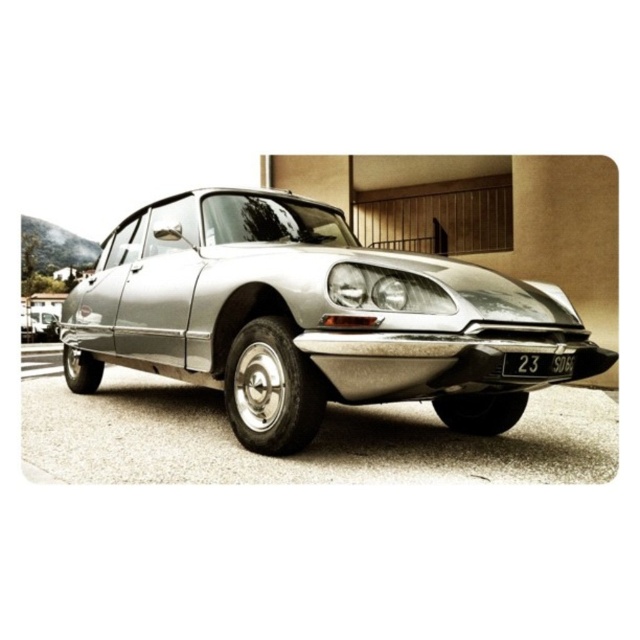
You are standing in front of a shiny silver car at center and want to touch the satin chrome headlight at center. Which part should you reach towards first?

The satin chrome headlight at center is closer to the viewer than the shiny silver car at center, so you should reach towards the satin chrome headlight at center first.

You are a delivery person trying to park a 2.0 meters wide delivery van next to the silver metallic car at center. Is there enough space between the car and the curb to fit the van?

The space between the silver metallic car at center and the curb is 1.92 meters, which is less than the van width of 2.0 meters. Therefore, the van cannot fit in the available space.